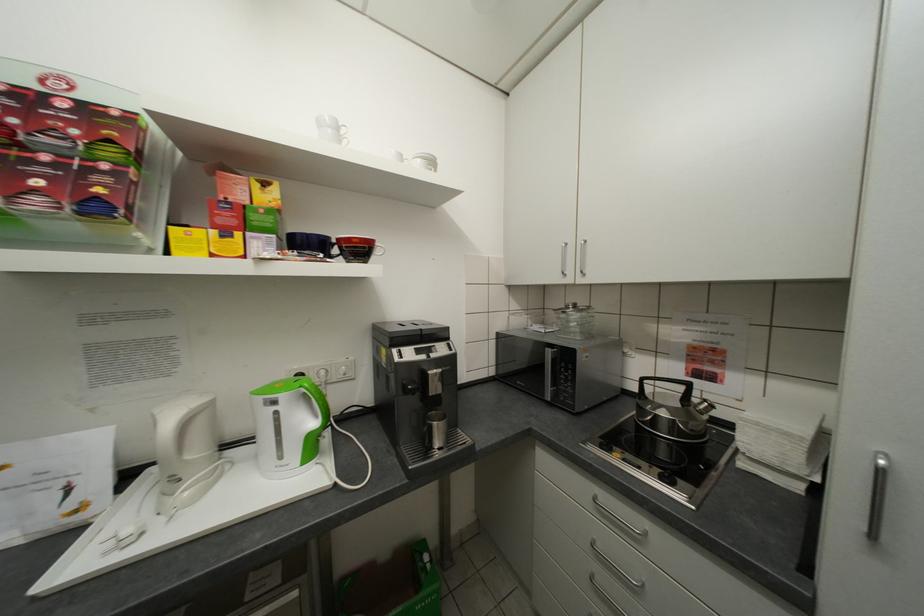
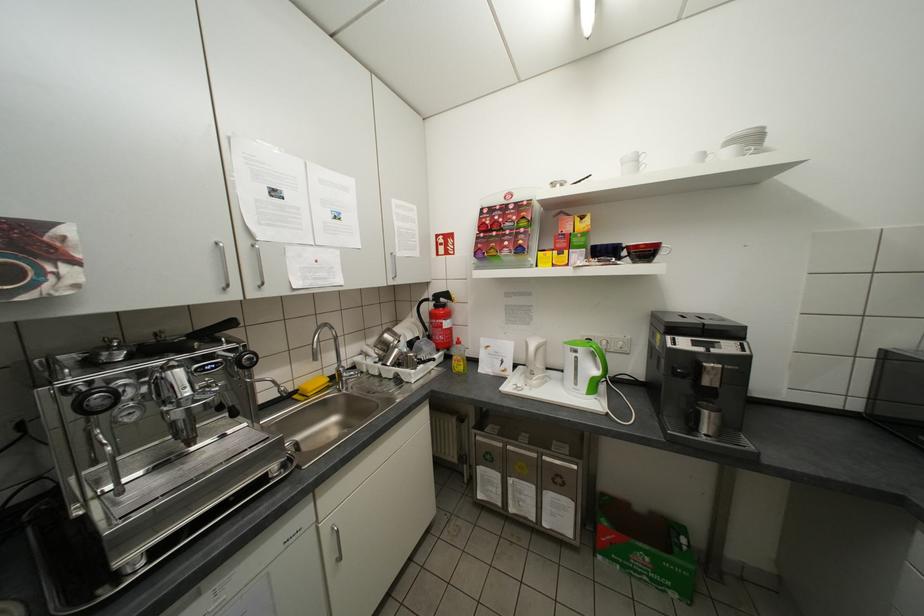
Where in the second image is the point corresponding to (302,252) from the first image?

(603, 259)